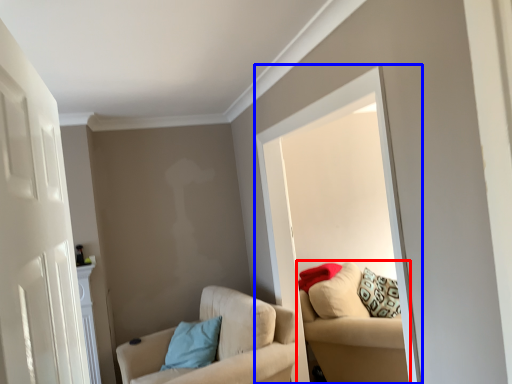
Question: Which object is further to the camera taking this photo, studio couch (highlighted by a red box) or window (highlighted by a blue box)?

Choices:
 (A) studio couch
 (B) window

Answer: (A)